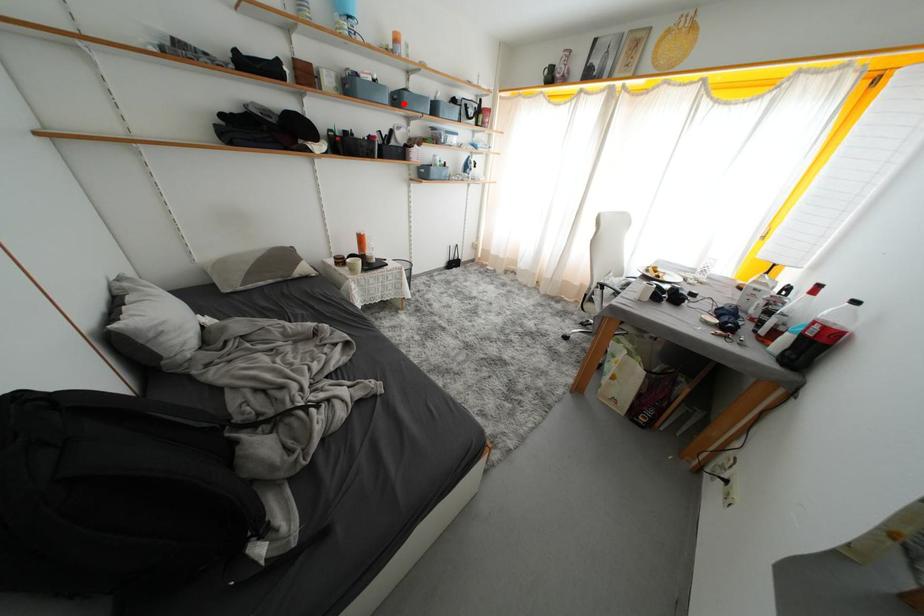
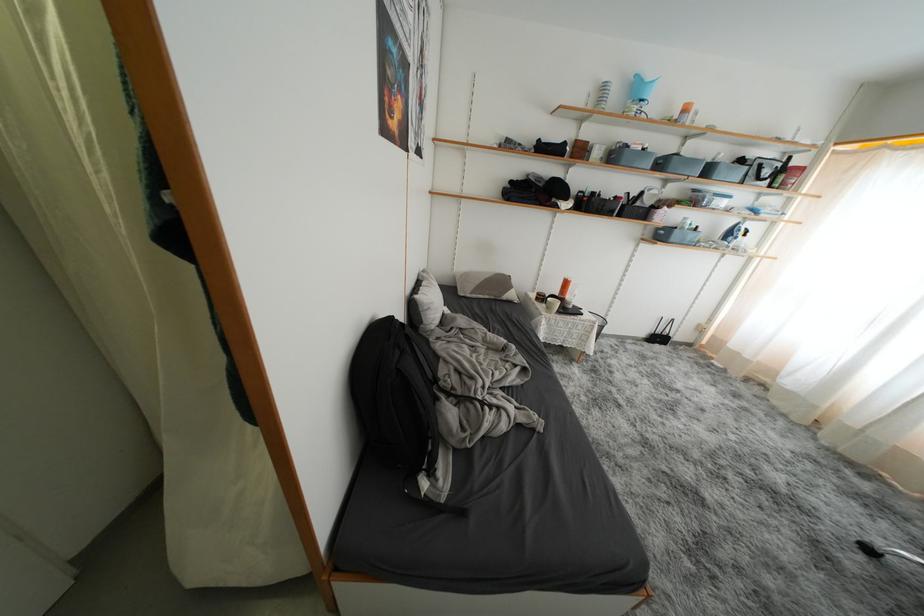
The point at the highlighted location is marked in the first image. Where is the corresponding point in the second image?

(667, 168)